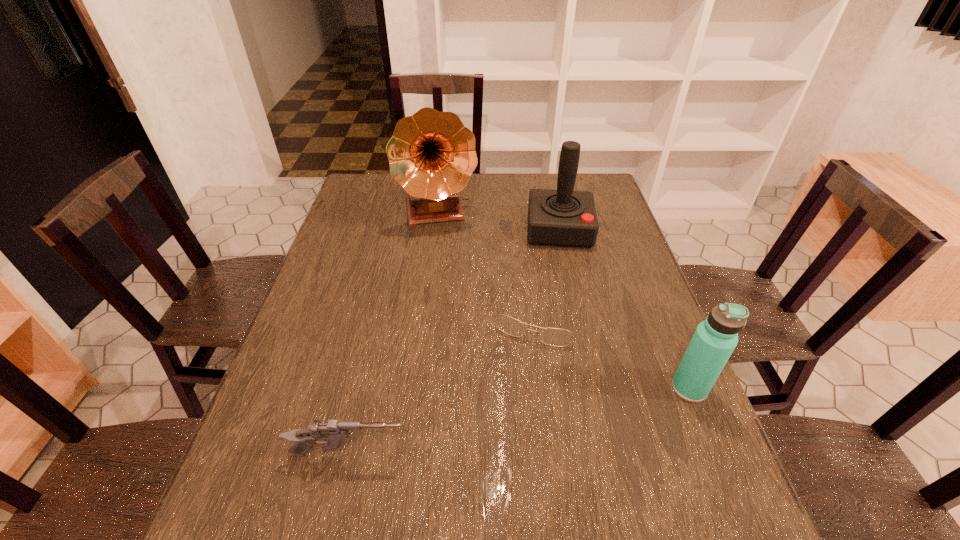
Find the location of a particular element. The height and width of the screenshot is (540, 960). the nearest object is located at coordinates (333, 433).

In order to click on gun in this screenshot , I will do `click(333, 433)`.

This screenshot has width=960, height=540. In order to click on thermos bottle in this screenshot , I will do `click(714, 340)`.

Locate an element on the screen. the rightmost object is located at coordinates (714, 340).

The image size is (960, 540). I want to click on the tallest object, so click(x=432, y=155).

Where is `spectacles`? The height and width of the screenshot is (540, 960). spectacles is located at coordinates (556, 337).

Find the location of a particular element. This screenshot has height=540, width=960. the third nearest object is located at coordinates (556, 337).

Locate an element on the screen. The width and height of the screenshot is (960, 540). joystick is located at coordinates (563, 217).

The width and height of the screenshot is (960, 540). What are the coordinates of `vacant area situated at the barrel of the gun` in the screenshot? It's located at (565, 455).

In order to click on free space located on the left of the rightmost object in this screenshot , I will do `click(622, 388)`.